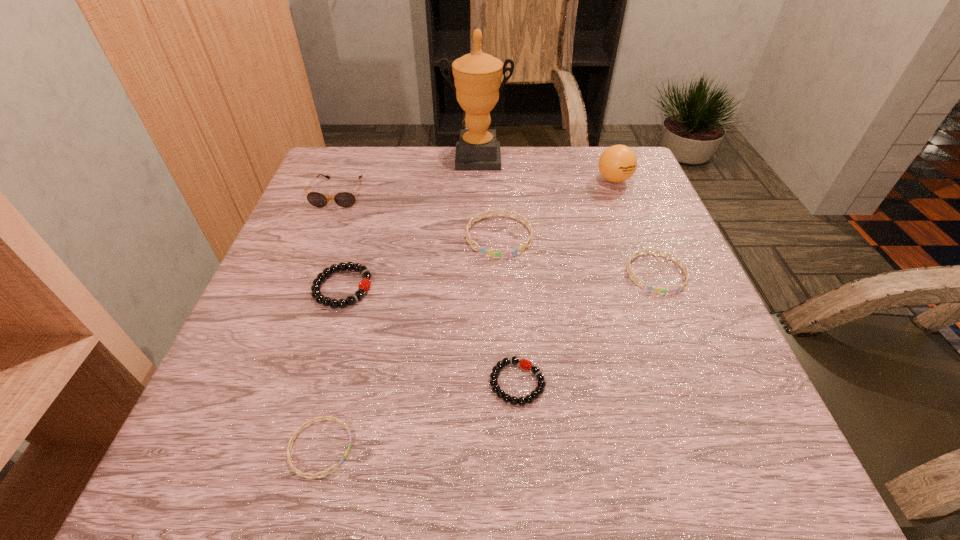
At what (x,y) coordinates should I click in order to perform the action: click on object that ranks as the fourth closest to the second blue bracelet from left to right. Please return your answer as a coordinate pair (x, y). Looking at the image, I should click on (617, 163).

Locate an element on the screen. bracelet that is the closest to the left black bracelet is located at coordinates (482, 250).

Image resolution: width=960 pixels, height=540 pixels. I want to click on bracelet identified as the third closest to the shortest bracelet, so click(482, 250).

In order to click on blue bracelet identified as the closest to the ping-pong ball in this screenshot , I will do `click(482, 250)`.

Locate an element on the screen. The height and width of the screenshot is (540, 960). blue bracelet that can be found as the second closest to the biggest blue bracelet is located at coordinates 302,474.

You are a GUI agent. You are given a task and a screenshot of the screen. Output one action in this format:
    pyautogui.click(x=<x>, y=<y>)
    Task: Click on the vacant region that satisfies the following two spatial constraints: 1. at the front of the tallest object with handles; 2. on the surface of the smallest blue bracelet showing star-shaped elements
    This screenshot has height=540, width=960.
    Given the screenshot: What is the action you would take?
    pyautogui.click(x=474, y=448)

At what (x,y) coordinates should I click in order to perform the action: click on free space that satisfies the following two spatial constraints: 1. on the lenses of the sunglasses; 2. on the left side of the left black bracelet. Please return your answer as a coordinate pair (x, y). The image size is (960, 540). Looking at the image, I should click on (301, 288).